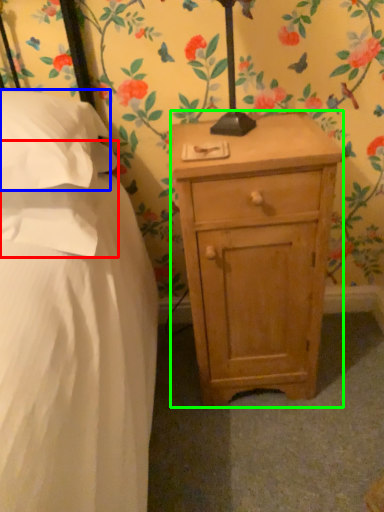
Question: Based on their relative distances, which object is nearer to pillow (highlighted by a red box)? Choose from pillow (highlighted by a blue box) and nightstand (highlighted by a green box).

Choices:
 (A) pillow
 (B) nightstand

Answer: (A)